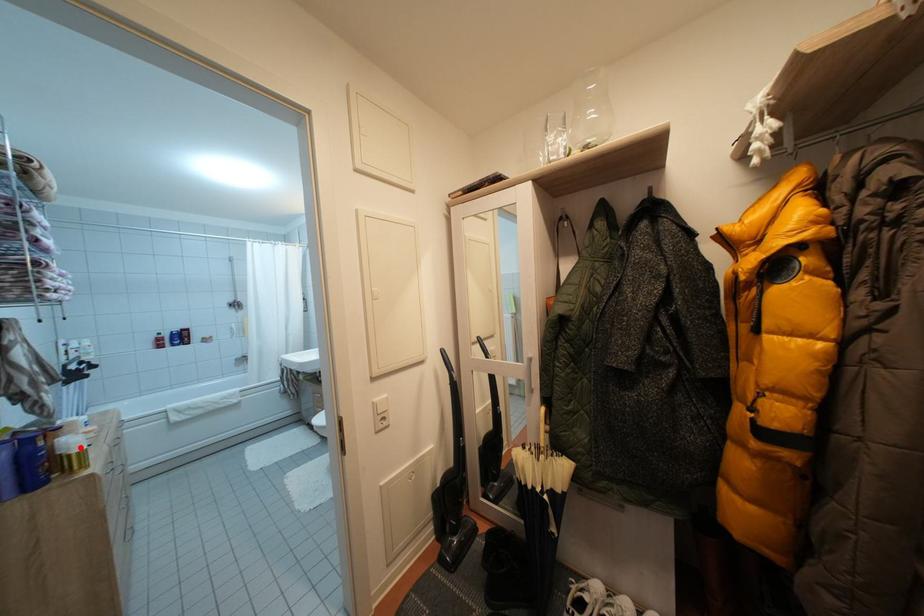
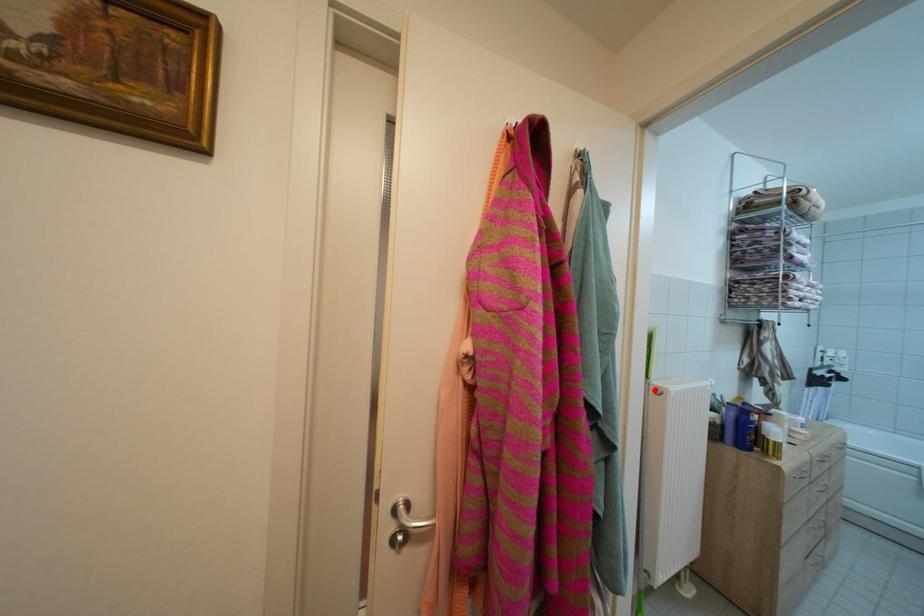
I am providing you with two images of the same scene from different viewpoints. A red point is marked on the first image and another point is marked on the second image. Does the point marked in image1 correspond to the same location as the one in image2?

No